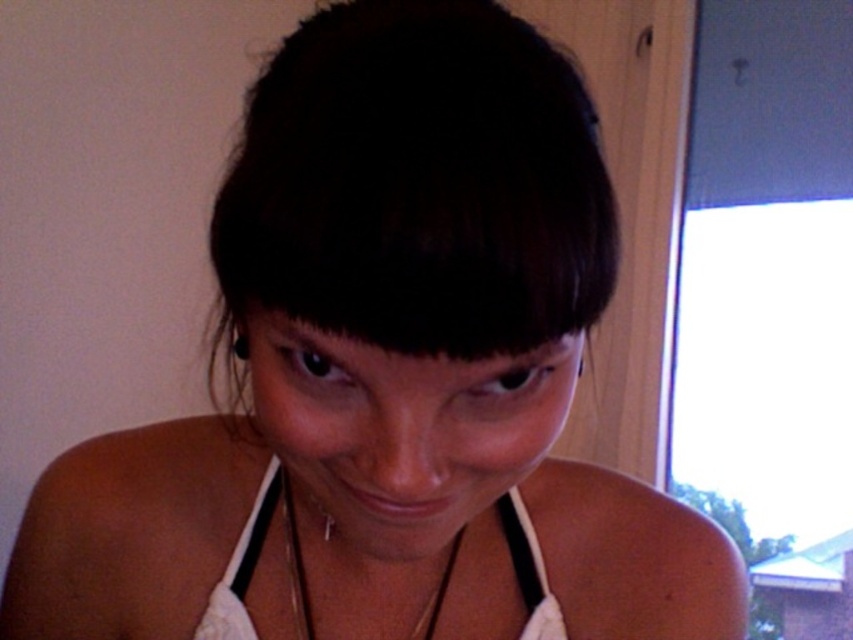
Can you confirm if dark brown hair at center is wider than gold chain at lower center?

Yes.

Can you confirm if dark brown hair at center is positioned to the left of gold chain at lower center?

Incorrect, dark brown hair at center is not on the left side of gold chain at lower center.

Where is `dark brown hair at center`? This screenshot has width=853, height=640. dark brown hair at center is located at coordinates (416, 184).

This screenshot has width=853, height=640. Describe the element at coordinates (242, 566) in the screenshot. I see `white fabric bikini top at center` at that location.

Does white fabric bikini top at center have a smaller size compared to gold chain at lower center?

Actually, white fabric bikini top at center might be larger than gold chain at lower center.

Between point (201, 630) and point (293, 554), which one is positioned in front?

Positioned in front is point (201, 630).

The image size is (853, 640). I want to click on white fabric bikini top at center, so click(242, 566).

Is gold chain at lower center in front of white fabric strap at lower center?

Yes, gold chain at lower center is in front of white fabric strap at lower center.

Is gold chain at lower center to the left of white fabric strap at lower center from the viewer's perspective?

Indeed, gold chain at lower center is positioned on the left side of white fabric strap at lower center.

Is point (293, 576) positioned behind point (514, 548)?

No, it is in front of (514, 548).

This screenshot has height=640, width=853. Identify the location of gold chain at lower center. (294, 563).